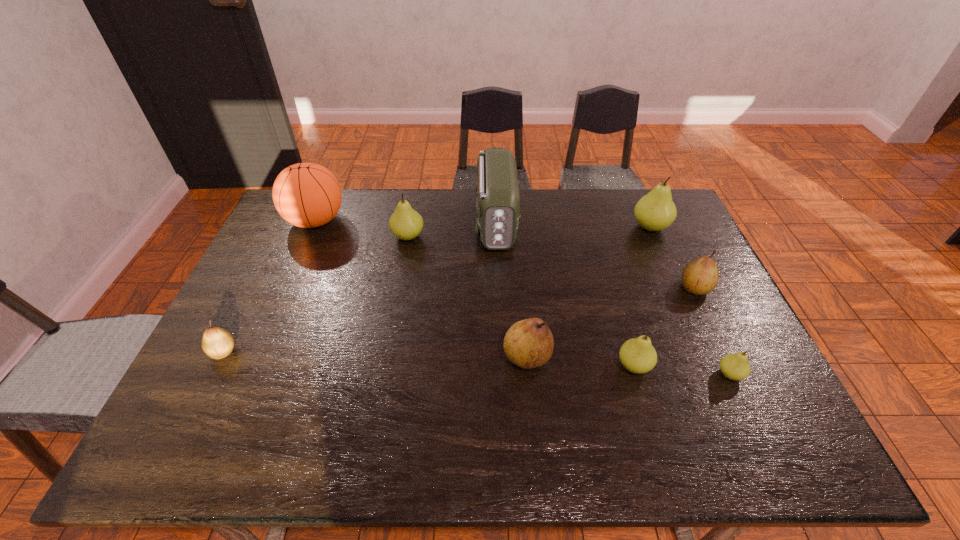
Identify the location of vacant space that satisfies the following two spatial constraints: 1. on the front side of the third pear from left to right; 2. on the right side of the second pear from left to right. (387, 357).

At what (x,y) coordinates should I click in order to perform the action: click on vacant point that satisfies the following two spatial constraints: 1. on the front-facing side of the radio_receiver; 2. on the right side of the sixth object from left to right. Please return your answer as a coordinate pair (x, y). Image resolution: width=960 pixels, height=540 pixels. Looking at the image, I should click on (501, 366).

At what (x,y) coordinates should I click in order to perform the action: click on free region that satisfies the following two spatial constraints: 1. on the front-facing side of the radio_receiver; 2. on the left side of the third green pear from right to left. Please return your answer as a coordinate pair (x, y). Looking at the image, I should click on (501, 366).